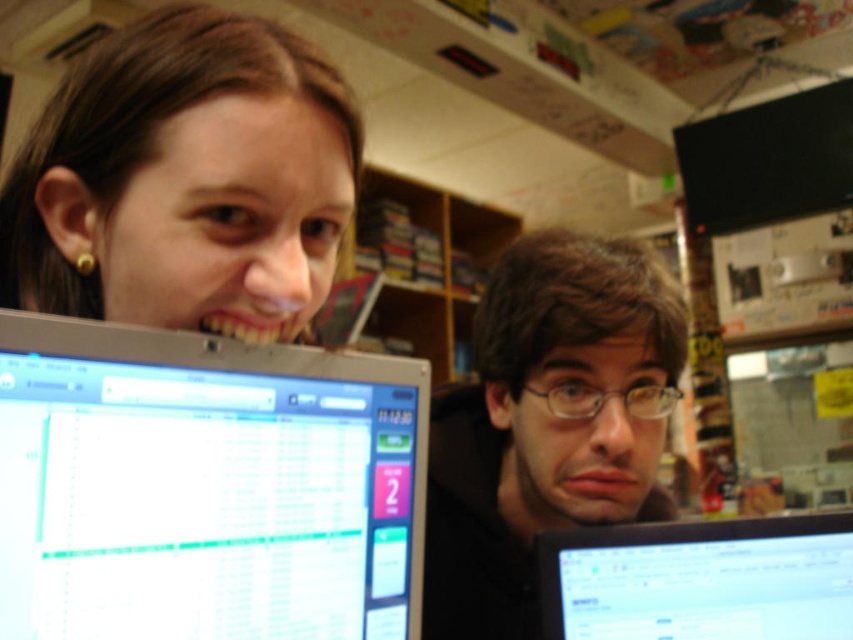
You are organizing a small meeting in this workspace and need to move the black glossy monitor at lower right and the wooden shelves at center to make room. Which object requires more space to move?

The wooden shelves at center require more space to move because the black glossy monitor at lower right occupies less space than wooden shelves at center.

You are a delivery person who needs to place a small package on the desk. The package is 45 centimeters long. Can you fit it horizontally between the silver metallic monitor at left and the edge of the desk?

The silver metallic monitor at left is 45.80 centimeters away from the viewer. Since the package is only 45 centimeters long, it should fit horizontally between the silver metallic monitor at left and the edge of the desk as there is enough space.

You are trying to determine which object is shorter between the matte black face at upper left and the matte black glasses at center. Based on the scene, which one is shorter?

The matte black face at upper left is shorter than the matte black glasses at center.